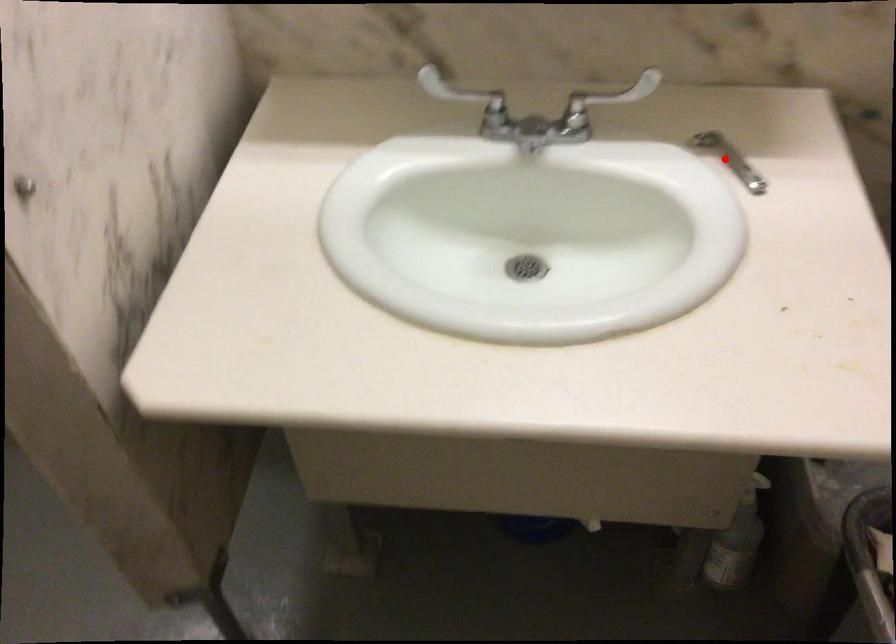
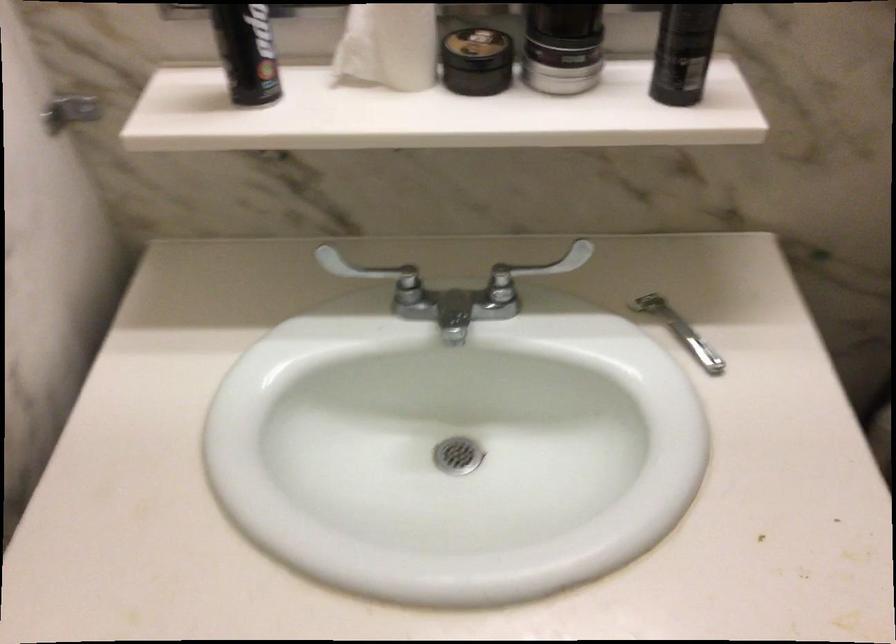
Locate, in the second image, the point that corresponds to the highlighted location in the first image.

(679, 330)